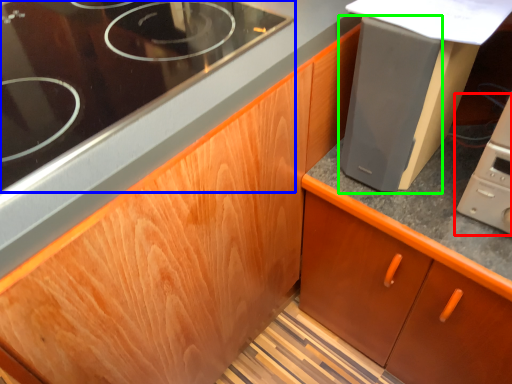
Question: Which object is the farthest from home appliance (highlighted by a red box)? Choose among these: gas stove (highlighted by a blue box) or appliance (highlighted by a green box).

Choices:
 (A) gas stove
 (B) appliance

Answer: (A)